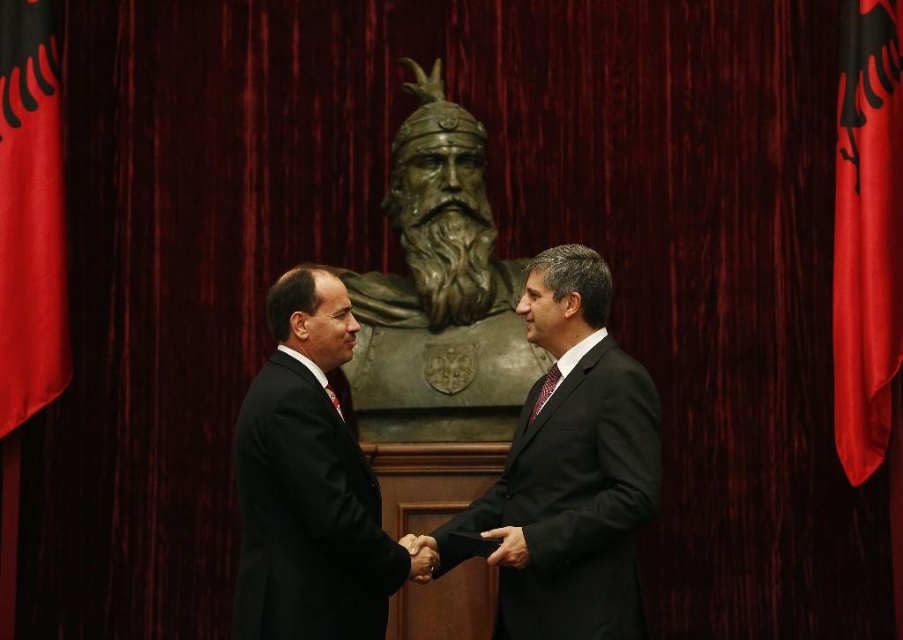
Question: Among these points, which one is nearest to the camera?

Choices:
 (A) (596, 323)
 (B) (427, 99)

Answer: (A)

Question: From the image, what is the correct spatial relationship of shiny bronze bust at center in relation to bronze bust at center?

Choices:
 (A) below
 (B) above

Answer: (A)

Question: Which point is farther to the camera?

Choices:
 (A) bronze bust at center
 (B) black suit at center

Answer: (A)

Question: Can you confirm if black suit at center is positioned below bronze bust at center?

Choices:
 (A) no
 (B) yes

Answer: (B)

Question: Estimate the real-world distances between objects in this image. Which object is closer to the smooth skin handshake at center?

Choices:
 (A) bronze bust at center
 (B) shiny bronze bust at center
 (C) black suit at center

Answer: (C)

Question: Is shiny bronze bust at center thinner than smooth skin handshake at center?

Choices:
 (A) no
 (B) yes

Answer: (A)